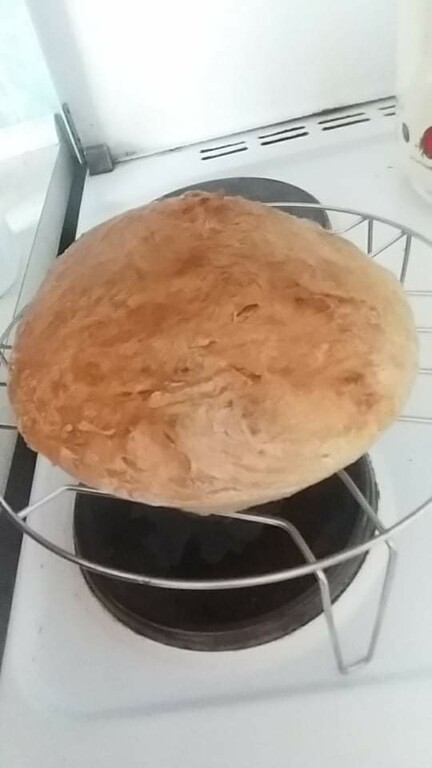
At what (x,y) coordinates should I click in order to perform the action: click on cooling rack. Please return your answer as a coordinate pair (x, y). The width and height of the screenshot is (432, 768). Looking at the image, I should click on (55, 548), (372, 217).